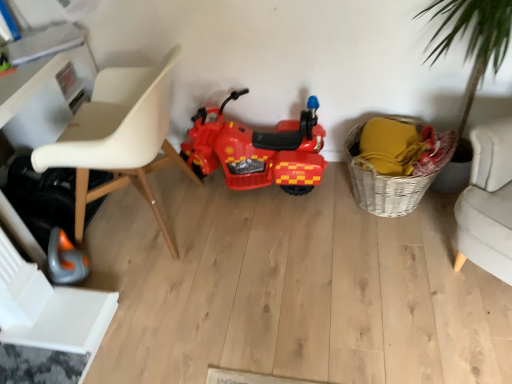
Where is `unoccupied area in front of white plastic chair at left`? The width and height of the screenshot is (512, 384). unoccupied area in front of white plastic chair at left is located at coordinates (181, 309).